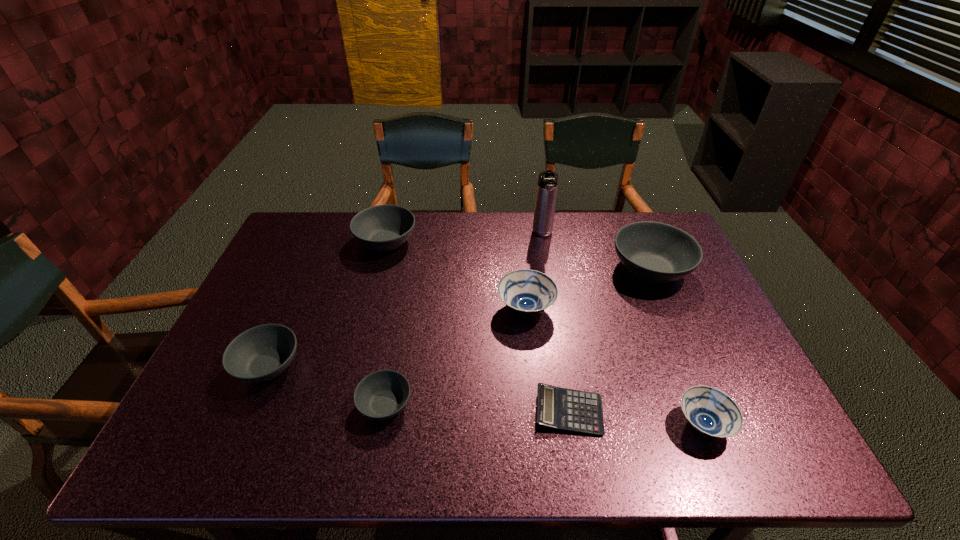
Where is `thermos bottle`? This screenshot has width=960, height=540. thermos bottle is located at coordinates (547, 184).

Locate an element on the screen. the tallest soup bowl is located at coordinates (657, 253).

In order to click on the biggest gray soup bowl in this screenshot , I will do `click(657, 253)`.

The height and width of the screenshot is (540, 960). What are the coordinates of `the second biggest gray soup bowl` in the screenshot? It's located at (382, 228).

What are the coordinates of `the third soup bowl from right to left` in the screenshot? It's located at (526, 292).

The width and height of the screenshot is (960, 540). In order to click on the farther blue soup bowl in this screenshot , I will do `click(526, 292)`.

What are the coordinates of `the leftmost object` in the screenshot? It's located at (261, 353).

Where is `the leftmost gray soup bowl`? The height and width of the screenshot is (540, 960). the leftmost gray soup bowl is located at coordinates (261, 353).

You are a GUI agent. You are given a task and a screenshot of the screen. Output one action in this format:
    pyautogui.click(x=<x>, y=<y>)
    Task: Click on the smaller blue soup bowl
    The width and height of the screenshot is (960, 540).
    Given the screenshot: What is the action you would take?
    pyautogui.click(x=711, y=412)

This screenshot has height=540, width=960. In order to click on the right blue soup bowl in this screenshot , I will do `click(711, 412)`.